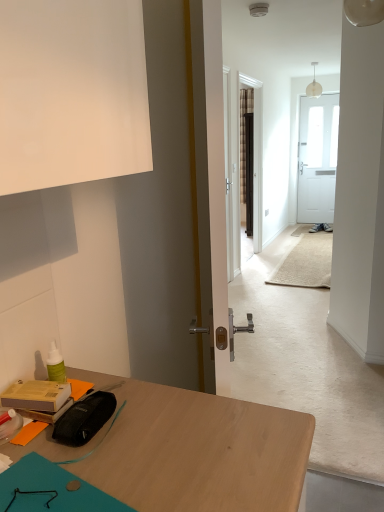
At what (x,y) coordinates should I click in order to perform the action: click on matte cardboard box at lower left, acting as the 2th stationery starting from the right. Please return your answer as a coordinate pair (x, y). Looking at the image, I should click on (36, 396).

Is matte cardboard box at lower left, the first stationery when ordered from left to right, taller than matte black pouch at lower left, the 2th stationery when ordered from left to right?

Correct, matte cardboard box at lower left, the first stationery when ordered from left to right, is much taller as matte black pouch at lower left, the 2th stationery when ordered from left to right.

From a real-world perspective, is matte cardboard box at lower left, the first stationery when ordered from left to right, over matte black pouch at lower left, the 1th stationery positioned from the right?

Correct, in the physical world, matte cardboard box at lower left, the first stationery when ordered from left to right, is higher than matte black pouch at lower left, the 1th stationery positioned from the right.

Is matte cardboard box at lower left, the first stationery when ordered from left to right, not inside matte black pouch at lower left, the 2th stationery when ordered from left to right?

That's correct, matte cardboard box at lower left, the first stationery when ordered from left to right, is outside of matte black pouch at lower left, the 2th stationery when ordered from left to right.

Which is in front, matte cardboard box at lower left, the first stationery when ordered from left to right, or matte black pouch at lower left, the 1th stationery positioned from the right?

matte black pouch at lower left, the 1th stationery positioned from the right.

Is matte black pouch at lower left, the 1th stationery positioned from the right, next to translucent glass pendant light at upper center?

matte black pouch at lower left, the 1th stationery positioned from the right, and translucent glass pendant light at upper center are clearly separated.

Is translucent glass pendant light at upper center surrounded by matte black pouch at lower left, the 1th stationery positioned from the right?

That's incorrect, translucent glass pendant light at upper center is not inside matte black pouch at lower left, the 1th stationery positioned from the right.

Considering the relative positions of matte black pouch at lower left, the 1th stationery positioned from the right, and translucent glass pendant light at upper center in the image provided, is matte black pouch at lower left, the 1th stationery positioned from the right, to the right of translucent glass pendant light at upper center from the viewer's perspective?

In fact, matte black pouch at lower left, the 1th stationery positioned from the right, is to the left of translucent glass pendant light at upper center.

From the image's perspective, which stationery is the 2nd one below the translucent glass pendant light at upper center? Please provide its 2D coordinates.

[(84, 418)]

Is translucent glass pendant light at upper center at the right side of matte cardboard box at lower left, the first stationery when ordered from left to right?

Yes, translucent glass pendant light at upper center is to the right of matte cardboard box at lower left, the first stationery when ordered from left to right.

From a real-world perspective, relative to matte cardboard box at lower left, acting as the 2th stationery starting from the right, is translucent glass pendant light at upper center vertically above or below?

translucent glass pendant light at upper center is above matte cardboard box at lower left, acting as the 2th stationery starting from the right.

From the image's perspective, which one is positioned lower, translucent glass pendant light at upper center or matte cardboard box at lower left, acting as the 2th stationery starting from the right?

matte cardboard box at lower left, acting as the 2th stationery starting from the right, appears lower in the image.

Does translucent glass pendant light at upper center have a lesser width compared to matte cardboard box at lower left, acting as the 2th stationery starting from the right?

No, translucent glass pendant light at upper center is not thinner than matte cardboard box at lower left, acting as the 2th stationery starting from the right.

Are matte cardboard box at lower left, the first stationery when ordered from left to right, and translucent glass pendant light at upper center beside each other?

No, matte cardboard box at lower left, the first stationery when ordered from left to right, is not touching translucent glass pendant light at upper center.

Between point (57, 384) and point (313, 83), which one is positioned behind?

The point (313, 83) is farther from the camera.

From a real-world perspective, is matte cardboard box at lower left, the first stationery when ordered from left to right, physically above translucent glass pendant light at upper center?

No, from a real-world perspective, matte cardboard box at lower left, the first stationery when ordered from left to right, is not above translucent glass pendant light at upper center.

Can you confirm if matte cardboard box at lower left, the first stationery when ordered from left to right, is taller than translucent glass pendant light at upper center?

Incorrect, the height of matte cardboard box at lower left, the first stationery when ordered from left to right, is not larger of that of translucent glass pendant light at upper center.

Is matte black pouch at lower left, the 1th stationery positioned from the right, far away from matte cardboard box at lower left, acting as the 2th stationery starting from the right?

matte black pouch at lower left, the 1th stationery positioned from the right, is near matte cardboard box at lower left, acting as the 2th stationery starting from the right, not far away.

Is matte black pouch at lower left, the 1th stationery positioned from the right, turned away from matte cardboard box at lower left, acting as the 2th stationery starting from the right?

Yes, matte black pouch at lower left, the 1th stationery positioned from the right,'s orientation is away from matte cardboard box at lower left, acting as the 2th stationery starting from the right.

Is matte cardboard box at lower left, acting as the 2th stationery starting from the right, a part of matte black pouch at lower left, the 2th stationery when ordered from left to right?

Definitely not — matte cardboard box at lower left, acting as the 2th stationery starting from the right, is not inside matte black pouch at lower left, the 2th stationery when ordered from left to right.

From the image's perspective, is matte black pouch at lower left, the 2th stationery when ordered from left to right, on matte cardboard box at lower left, the first stationery when ordered from left to right?

No, from the image's perspective, matte black pouch at lower left, the 2th stationery when ordered from left to right, is not over matte cardboard box at lower left, the first stationery when ordered from left to right.

Locate an element on the screen. The height and width of the screenshot is (512, 384). lamp behind the matte black pouch at lower left, the 2th stationery when ordered from left to right is located at coordinates (314, 86).

Does translucent glass pendant light at upper center appear on the right side of matte black pouch at lower left, the 1th stationery positioned from the right?

Yes, translucent glass pendant light at upper center is to the right of matte black pouch at lower left, the 1th stationery positioned from the right.

Is translucent glass pendant light at upper center taller or shorter than matte black pouch at lower left, the 1th stationery positioned from the right?

translucent glass pendant light at upper center is taller than matte black pouch at lower left, the 1th stationery positioned from the right.

Image resolution: width=384 pixels, height=512 pixels. In order to click on stationery that appears below the matte cardboard box at lower left, the first stationery when ordered from left to right (from the image's perspective) in this screenshot , I will do `click(84, 418)`.

I want to click on the 1st stationery counting from the left side of the translucent glass pendant light at upper center, so click(84, 418).

Which object lies nearer to the anchor point translucent glass pendant light at upper center, matte cardboard box at lower left, acting as the 2th stationery starting from the right, or matte black pouch at lower left, the 1th stationery positioned from the right?

Based on the image, matte cardboard box at lower left, acting as the 2th stationery starting from the right, appears to be nearer to translucent glass pendant light at upper center.

From the image, which object appears to be farther from translucent glass pendant light at upper center, matte black pouch at lower left, the 1th stationery positioned from the right, or matte cardboard box at lower left, the first stationery when ordered from left to right?

Based on the image, matte black pouch at lower left, the 1th stationery positioned from the right, appears to be further to translucent glass pendant light at upper center.

From the image, which object appears to be nearer to matte black pouch at lower left, the 2th stationery when ordered from left to right, matte cardboard box at lower left, acting as the 2th stationery starting from the right, or translucent glass pendant light at upper center?

The object closer to matte black pouch at lower left, the 2th stationery when ordered from left to right, is matte cardboard box at lower left, acting as the 2th stationery starting from the right.

Which object lies further to the anchor point matte cardboard box at lower left, the first stationery when ordered from left to right, translucent glass pendant light at upper center or matte black pouch at lower left, the 1th stationery positioned from the right?

Among the two, translucent glass pendant light at upper center is located further to matte cardboard box at lower left, the first stationery when ordered from left to right.

When comparing their distances from matte cardboard box at lower left, the first stationery when ordered from left to right, does matte black pouch at lower left, the 2th stationery when ordered from left to right, or translucent glass pendant light at upper center seem further?

Among the two, translucent glass pendant light at upper center is located further to matte cardboard box at lower left, the first stationery when ordered from left to right.

Estimate the real-world distances between objects in this image. Which object is closer to matte black pouch at lower left, the 1th stationery positioned from the right, translucent glass pendant light at upper center or matte cardboard box at lower left, acting as the 2th stationery starting from the right?

matte cardboard box at lower left, acting as the 2th stationery starting from the right, is closer to matte black pouch at lower left, the 1th stationery positioned from the right.

You are a GUI agent. You are given a task and a screenshot of the screen. Output one action in this format:
    pyautogui.click(x=<x>, y=<y>)
    Task: Click on the stationery between matte black pouch at lower left, the 1th stationery positioned from the right, and translucent glass pendant light at upper center from front to back
    Image resolution: width=384 pixels, height=512 pixels.
    Given the screenshot: What is the action you would take?
    pyautogui.click(x=36, y=396)